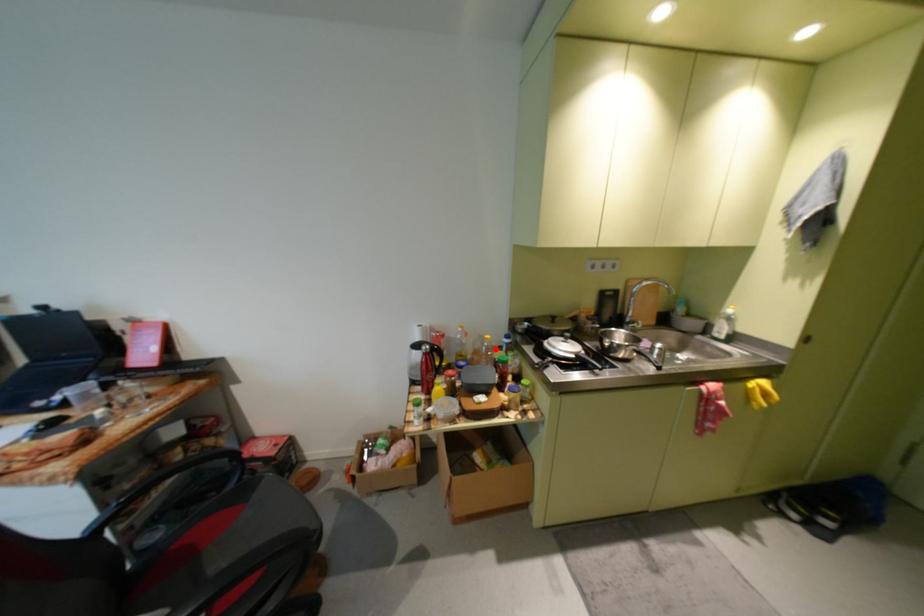
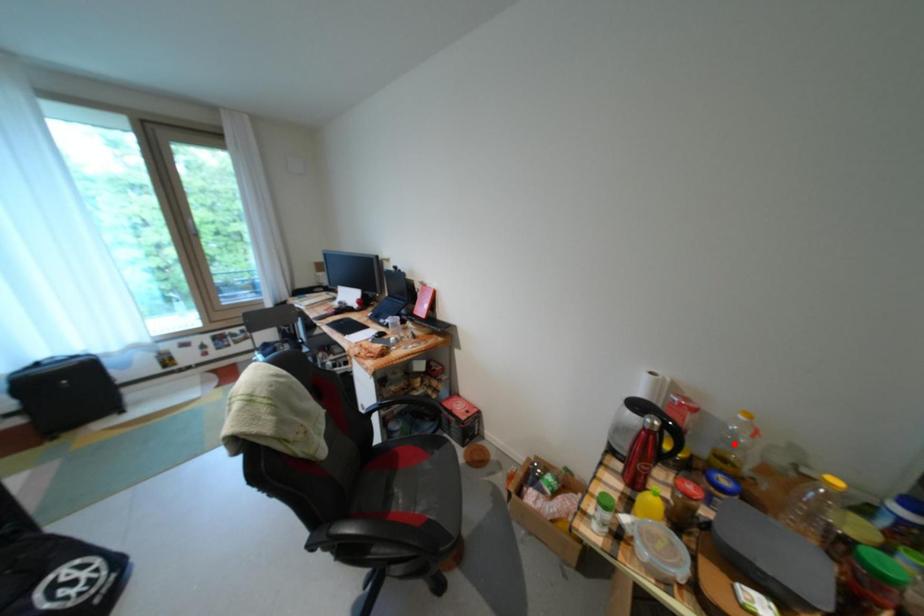
I am providing you with two images of the same scene from different viewpoints. A red point is marked on the first image and another point is marked on the second image. Do the highlighted points in image1 and image2 indicate the same real-world spot?

No